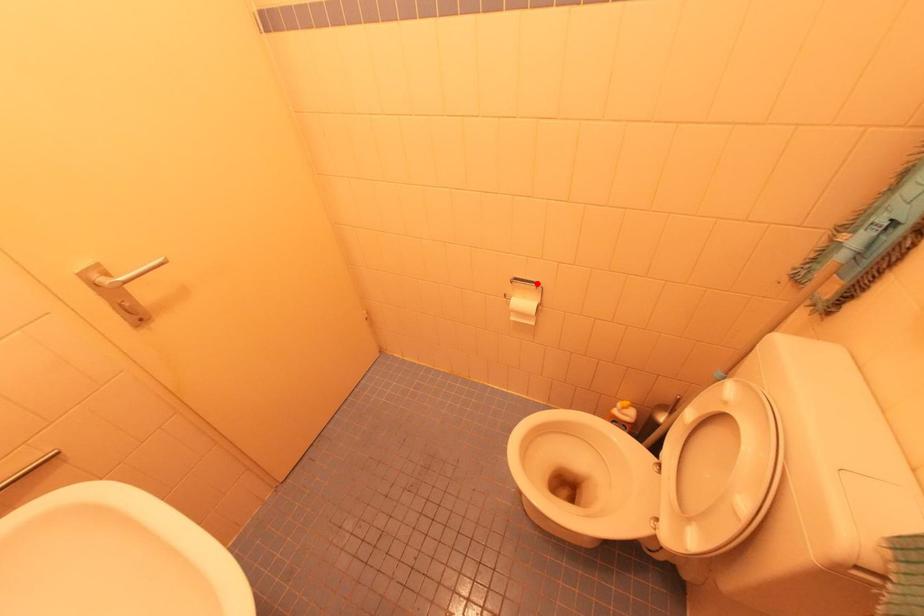
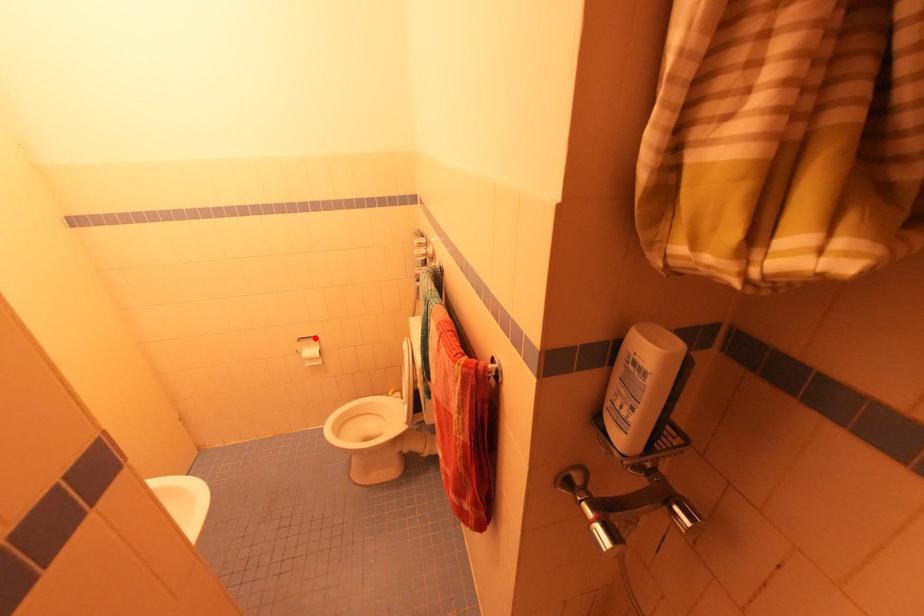
I am providing you with two images of the same scene from different viewpoints. A red point is marked on the first image and another point is marked on the second image. Is the red point in image1 aligned with the point shown in image2?

Yes